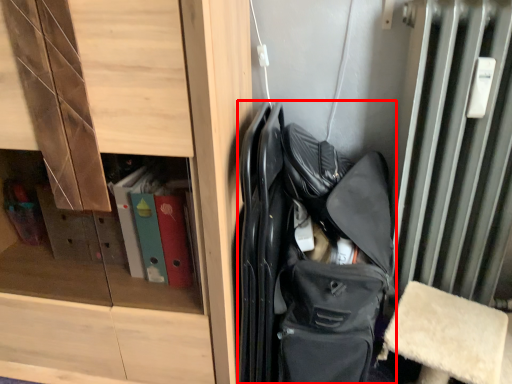
Question: Observing the image, what is the correct spatial positioning of bag (annotated by the red box) in reference to cabinetry?

Choices:
 (A) left
 (B) right

Answer: (B)